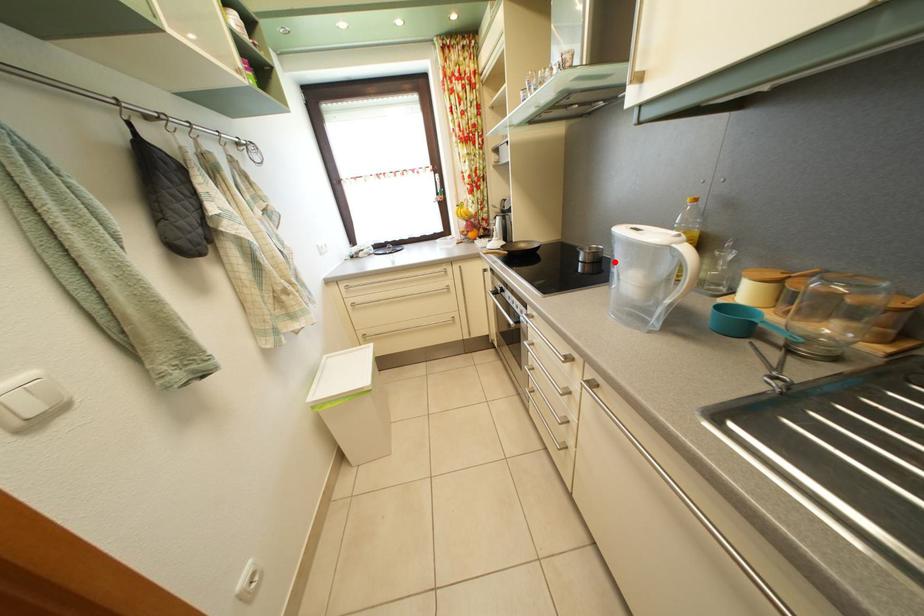
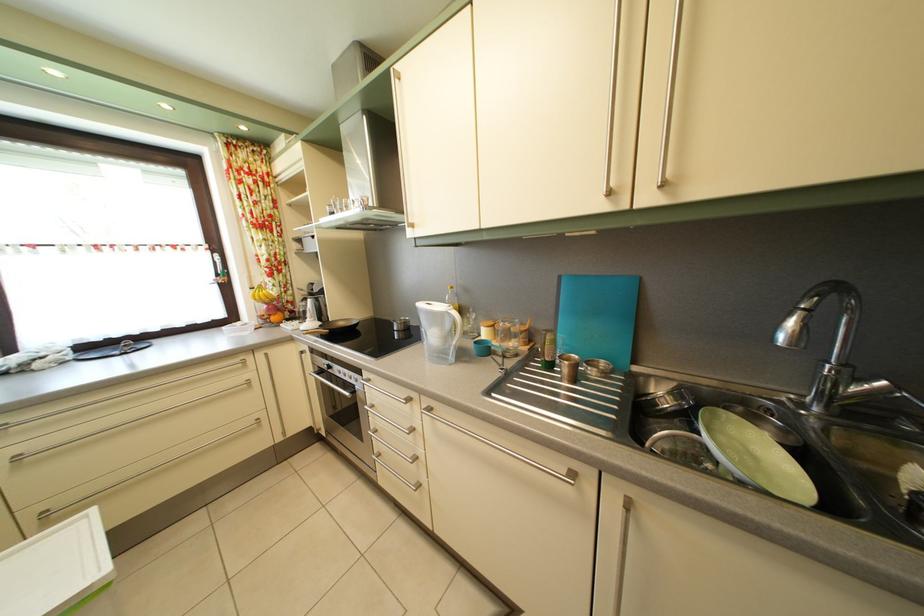
Question: I am providing you with two images of the same scene from different viewpoints. Image1 has a red point marked. In image2, the corresponding 3D location appears at what relative position? Reply with the corresponding letter.

Choices:
 (A) Closer
 (B) Farther

Answer: (B)